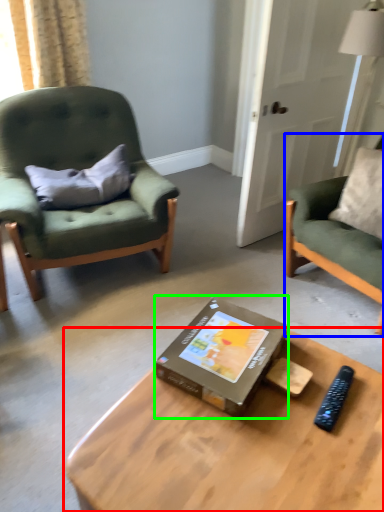
Question: Considering the real-world distances, which object is closest to coffee table (highlighted by a red box)? chair (highlighted by a blue box) or box (highlighted by a green box).

Choices:
 (A) chair
 (B) box

Answer: (B)